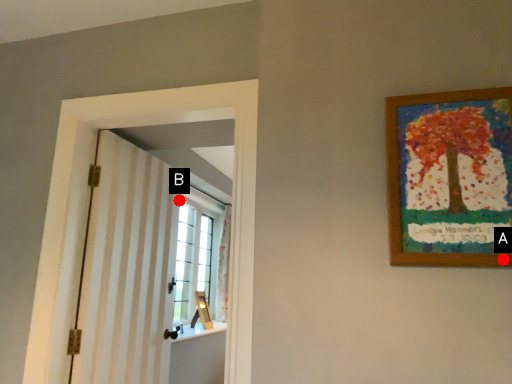
Question: Two points are circled on the image, labeled by A and B beside each circle. Which of the following is the farthest from the observer?

Choices:
 (A) A is further
 (B) B is further

Answer: (B)